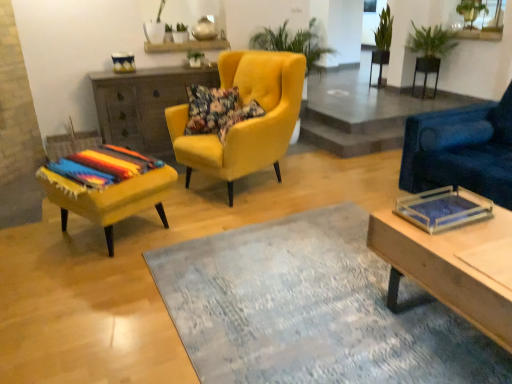
How much space does floral fabric pillow at center, which is counted as the 1th pillow, starting from the left, occupy vertically?

The height of floral fabric pillow at center, which is counted as the 1th pillow, starting from the left, is 37.01 centimeters.

In order to face green leafy plant at upper right, the 1th plant when ordered from right to left, should I rotate leftwards or rightwards?

Turn right by 26.976 degrees to look at green leafy plant at upper right, the 1th plant when ordered from right to left.

Describe the element at coordinates (461, 150) in the screenshot. Image resolution: width=512 pixels, height=384 pixels. I see `velvet blue armchair at right, acting as the 3th chair starting from the left` at that location.

Image resolution: width=512 pixels, height=384 pixels. What are the coordinates of `wooden cabinet at center` in the screenshot? It's located at (144, 104).

This screenshot has width=512, height=384. What do you see at coordinates (144, 104) in the screenshot?
I see `wooden cabinet at center` at bounding box center [144, 104].

Locate an element on the screen. floral fabric pillow at center, the second pillow in the left-to-right sequence is located at coordinates (238, 117).

From the image's perspective, is green leafy plant at upper right, the 1th plant when ordered from right to left, located above floral fabric pillow at center, the second pillow in the left-to-right sequence?

Yes, from the image's perspective, green leafy plant at upper right, the 1th plant when ordered from right to left, is above floral fabric pillow at center, the second pillow in the left-to-right sequence.

Is green leafy plant at upper right, acting as the 3th plant starting from the left, surrounding floral fabric pillow at center, the second pillow in the left-to-right sequence?

No, floral fabric pillow at center, the second pillow in the left-to-right sequence, is not surrounded by green leafy plant at upper right, acting as the 3th plant starting from the left.

Where is `the 3rd plant counting from the right of the floral fabric pillow at center, the second pillow in the left-to-right sequence`? Image resolution: width=512 pixels, height=384 pixels. the 3rd plant counting from the right of the floral fabric pillow at center, the second pillow in the left-to-right sequence is located at coordinates (471, 11).

Can you confirm if velvet yellow armchair at center, the 2th chair from the right, is bigger than green leafy plant at upper right, arranged as the 3th plant when viewed from the right?

Correct, velvet yellow armchair at center, the 2th chair from the right, is larger in size than green leafy plant at upper right, arranged as the 3th plant when viewed from the right.

In terms of width, does velvet yellow armchair at center, placed as the second chair when sorted from left to right, look wider or thinner when compared to green leafy plant at upper right, the 1th plant from the left?

In the image, velvet yellow armchair at center, placed as the second chair when sorted from left to right, appears to be wider than green leafy plant at upper right, the 1th plant from the left.

Can you tell me how much velvet yellow armchair at center, the 2th chair from the right, and green leafy plant at upper right, the 1th plant from the left, differ in facing direction?

22.3 degrees separate the facing orientations of velvet yellow armchair at center, the 2th chair from the right, and green leafy plant at upper right, the 1th plant from the left.

Which is in front, velvet yellow armchair at center, the 2th chair from the right, or green leafy plant at upper right, the 1th plant from the left?

velvet yellow armchair at center, the 2th chair from the right, is more forward.

From the image's perspective, relative to floral fabric pillow at center, the second pillow in the left-to-right sequence, is velvet blue armchair at right, acting as the 3th chair starting from the left, above or below?

From the image's perspective, velvet blue armchair at right, acting as the 3th chair starting from the left, appears below floral fabric pillow at center, the second pillow in the left-to-right sequence.

From a real-world perspective, is velvet blue armchair at right, acting as the 3th chair starting from the left, over floral fabric pillow at center, the second pillow in the left-to-right sequence?

Incorrect, from a real-world perspective, velvet blue armchair at right, acting as the 3th chair starting from the left, is lower than floral fabric pillow at center, the second pillow in the left-to-right sequence.

Who is bigger, velvet blue armchair at right, the 1th chair from the right, or floral fabric pillow at center, the second pillow in the left-to-right sequence?

With larger size is velvet blue armchair at right, the 1th chair from the right.

Does velvet blue armchair at right, acting as the 3th chair starting from the left, have a lesser width compared to floral fabric pillow at center, the second pillow in the left-to-right sequence?

No.

From the image's perspective, is floral fabric pillow at center, which appears as the 1th pillow when viewed from the right, on top of black metal side table at upper right?

No, from the image's perspective, floral fabric pillow at center, which appears as the 1th pillow when viewed from the right, is not on top of black metal side table at upper right.

Is floral fabric pillow at center, the second pillow in the left-to-right sequence, facing away from black metal side table at upper right?

No, floral fabric pillow at center, the second pillow in the left-to-right sequence,'s orientation is not away from black metal side table at upper right.

Considering the sizes of objects floral fabric pillow at center, the second pillow in the left-to-right sequence, and black metal side table at upper right in the image provided, who is bigger, floral fabric pillow at center, the second pillow in the left-to-right sequence, or black metal side table at upper right?

floral fabric pillow at center, the second pillow in the left-to-right sequence, is bigger.

Which is more to the left, floral fabric pillow at center, which appears as the 1th pillow when viewed from the right, or black metal side table at upper right?

floral fabric pillow at center, which appears as the 1th pillow when viewed from the right, is more to the left.

Based on the photo, which object is closer to the camera taking this photo, black metal side table at upper right or velvet yellow armchair at center, the 2th chair from the right?

velvet yellow armchair at center, the 2th chair from the right, is in front.

From the image's perspective, relative to velvet yellow armchair at center, placed as the second chair when sorted from left to right, is black metal side table at upper right above or below?

Clearly, from the image's perspective, black metal side table at upper right is above velvet yellow armchair at center, placed as the second chair when sorted from left to right.

Is black metal side table at upper right oriented towards velvet yellow armchair at center, the 2th chair from the right?

No.

How much distance is there between black metal side table at upper right and velvet yellow armchair at center, the 2th chair from the right?

They are 12.90 feet apart.

In the scene shown: Is wooden cabinet at center located within velvet blue armchair at right, acting as the 3th chair starting from the left?

No, wooden cabinet at center is not surrounded by velvet blue armchair at right, acting as the 3th chair starting from the left.

Is velvet blue armchair at right, the 1th chair from the right, bigger or smaller than wooden cabinet at center?

Considering their sizes, velvet blue armchair at right, the 1th chair from the right, takes up more space than wooden cabinet at center.

Considering the positions of points (503, 189) and (117, 133), is point (503, 189) closer to camera compared to point (117, 133)?

Yes, point (503, 189) is in front of point (117, 133).

Does velvet blue armchair at right, the 1th chair from the right, have a lesser width compared to wooden cabinet at center?

Incorrect, the width of velvet blue armchair at right, the 1th chair from the right, is not less than that of wooden cabinet at center.

Which object is further away from the camera taking this photo, wooden rectangular tray at right or green leafy plant at upper right, which appears as the second plant when viewed from the right?

green leafy plant at upper right, which appears as the second plant when viewed from the right.

Is wooden rectangular tray at right not inside green leafy plant at upper right, which appears as the second plant when viewed from the right?

Indeed, wooden rectangular tray at right is completely outside green leafy plant at upper right, which appears as the second plant when viewed from the right.

Does wooden rectangular tray at right have a lesser height compared to green leafy plant at upper right, which appears as the second plant when viewed from the right?

In fact, wooden rectangular tray at right may be taller than green leafy plant at upper right, which appears as the second plant when viewed from the right.

Which of these two, wooden rectangular tray at right or green leafy plant at upper right, which appears as the second plant when viewed from the right, is wider?

wooden rectangular tray at right.

Locate an element on the screen. plant that is the 3rd object above the floral fabric pillow at center, which appears as the 1th pillow when viewed from the right (from a real-world perspective) is located at coordinates (471, 11).

Find the location of a particular element. The width and height of the screenshot is (512, 384). the 3rd plant positioned above the velvet yellow armchair at center, the 2th chair from the right (from the image's perspective) is located at coordinates (384, 30).

Which object lies further to the anchor point wooden cabinet at center, green leafy plant at upper right, acting as the 3th plant starting from the left, or floral fabric pillow at center, the second pillow in the left-to-right sequence?

green leafy plant at upper right, acting as the 3th plant starting from the left, is positioned further to the anchor wooden cabinet at center.

Estimate the real-world distances between objects in this image. Which object is further from wooden rectangular tray at right, velvet yellow armchair at center, the 2th chair from the right, or velvet blue armchair at right, acting as the 3th chair starting from the left?

velvet yellow armchair at center, the 2th chair from the right, is further to wooden rectangular tray at right.

From the image, which object appears to be nearer to green leafy plant at upper right, arranged as the 3th plant when viewed from the right, floral fabric pillow at center, which appears as the 1th pillow when viewed from the right, or matte yellow ottoman at left, the third chair from the right?

Among the two, floral fabric pillow at center, which appears as the 1th pillow when viewed from the right, is located nearer to green leafy plant at upper right, arranged as the 3th plant when viewed from the right.

When comparing their distances from green leafy plant at upper right, acting as the 3th plant starting from the left, does floral fabric pillow at center, which is counted as the 1th pillow, starting from the left, or matte yellow ottoman at left, which ranks as the first chair in left-to-right order, seem closer?

floral fabric pillow at center, which is counted as the 1th pillow, starting from the left, lies closer to green leafy plant at upper right, acting as the 3th plant starting from the left, than the other object.

Which object lies nearer to the anchor point wooden cabinet at center, green leafy plant at upper right, which appears as the second plant when viewed from the right, or velvet yellow armchair at center, placed as the second chair when sorted from left to right?

velvet yellow armchair at center, placed as the second chair when sorted from left to right, is positioned closer to the anchor wooden cabinet at center.

Consider the image. Looking at the image, which one is located closer to green leafy plant at upper right, acting as the 3th plant starting from the left, green leafy plant at upper right, the 1th plant from the left, or wooden rectangular tray at right?

Based on the image, green leafy plant at upper right, the 1th plant from the left, appears to be nearer to green leafy plant at upper right, acting as the 3th plant starting from the left.

In the scene shown: Estimate the real-world distances between objects in this image. Which object is closer to wooden cabinet at center, velvet blue armchair at right, the 1th chair from the right, or matte yellow ottoman at left, the third chair from the right?

matte yellow ottoman at left, the third chair from the right, lies closer to wooden cabinet at center than the other object.

Considering their positions, is wooden rectangular tray at right positioned closer to velvet blue armchair at right, acting as the 3th chair starting from the left, than matte yellow ottoman at left, which ranks as the first chair in left-to-right order?

The object closer to velvet blue armchair at right, acting as the 3th chair starting from the left, is wooden rectangular tray at right.

This screenshot has width=512, height=384. I want to click on coffee table located between floral fabric pillow at center, the second pillow in the left-to-right sequence, and velvet blue armchair at right, acting as the 3th chair starting from the left, in the left-right direction, so click(x=452, y=256).

This screenshot has width=512, height=384. I want to click on chair located between matte yellow ottoman at left, the third chair from the right, and wooden rectangular tray at right in the left-right direction, so click(x=247, y=120).

The height and width of the screenshot is (384, 512). Identify the location of side table located between matte yellow ottoman at left, the third chair from the right, and green leafy plant at upper right, the 1th plant when ordered from right to left, in the left-right direction. (426, 71).

At what (x,y) coordinates should I click in order to perform the action: click on table located between matte yellow ottoman at left, which ranks as the first chair in left-to-right order, and velvet blue armchair at right, the 1th chair from the right, in the left-right direction. Please return your answer as a coordinate pair (x, y). Looking at the image, I should click on (144, 104).